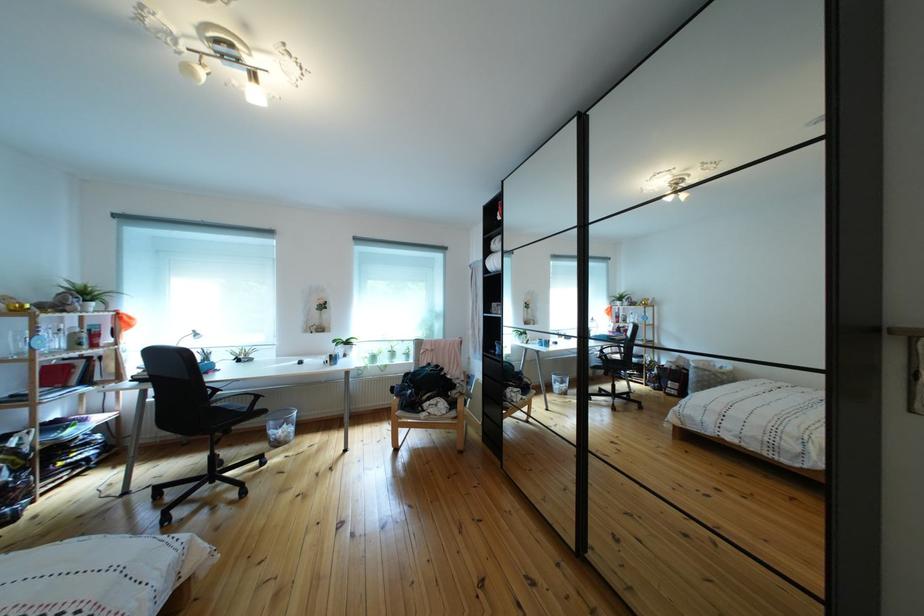
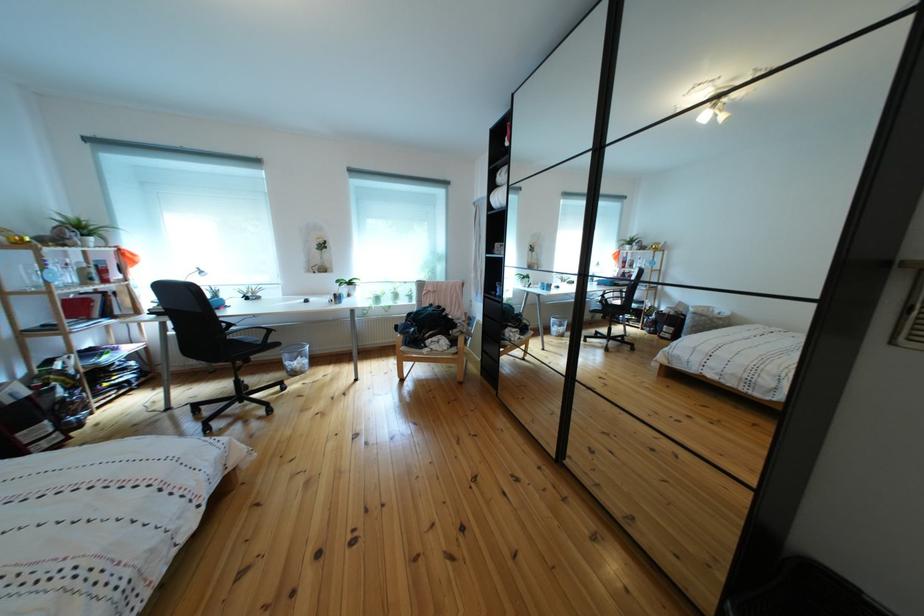
The point at [225,411] is marked in the first image. Where is the corresponding point in the second image?

(241, 342)